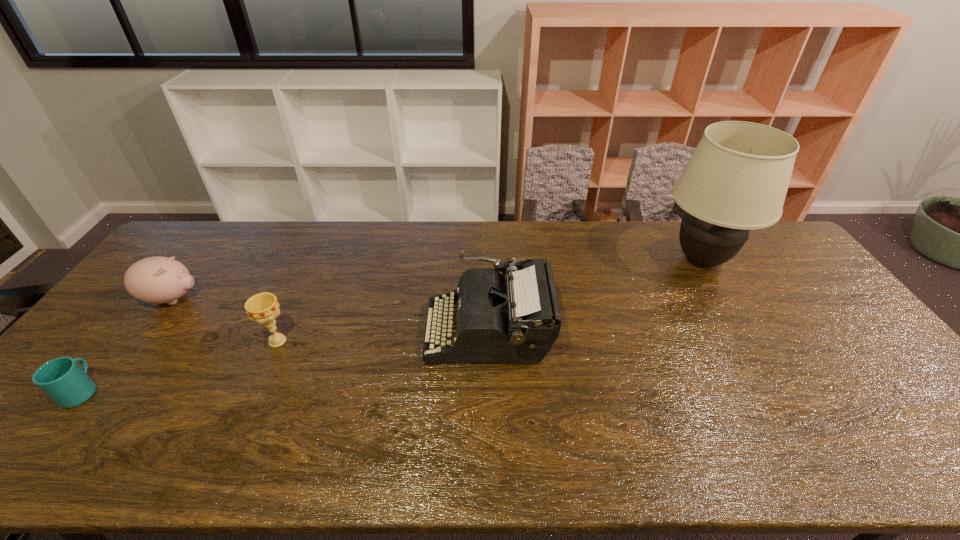
Locate an element on the screen. The width and height of the screenshot is (960, 540). free space at the near edge of the desktop is located at coordinates (572, 437).

You are a GUI agent. You are given a task and a screenshot of the screen. Output one action in this format:
    pyautogui.click(x=<x>, y=<y>)
    Task: Click on the free space at the left edge of the desktop
    
    Given the screenshot: What is the action you would take?
    pyautogui.click(x=109, y=342)

The image size is (960, 540). Find the location of `free spot at the right edge of the desktop`. free spot at the right edge of the desktop is located at coordinates (854, 373).

At what (x,y) coordinates should I click in order to perform the action: click on vacant point at the near right corner. Please return your answer as a coordinate pair (x, y). The image size is (960, 540). Looking at the image, I should click on (913, 443).

The width and height of the screenshot is (960, 540). I want to click on vacant space that's between the chalice and the shortest object, so point(180,366).

At what (x,y) coordinates should I click in order to perform the action: click on free space between the cup and the tallest object. Please return your answer as a coordinate pair (x, y). Looking at the image, I should click on (392, 326).

Locate an element on the screen. vacant area between the chalice and the piggy bank is located at coordinates (225, 320).

In order to click on free space between the fourth shortest object and the piggy bank in this screenshot , I will do `click(330, 314)`.

The height and width of the screenshot is (540, 960). Identify the location of vacant area that lies between the piggy bank and the tallest object. tap(437, 280).

You are a GUI agent. You are given a task and a screenshot of the screen. Output one action in this format:
    pyautogui.click(x=<x>, y=<y>)
    Task: Click on the free area in between the typewriter and the shortest object
    
    Given the screenshot: What is the action you would take?
    click(x=285, y=360)